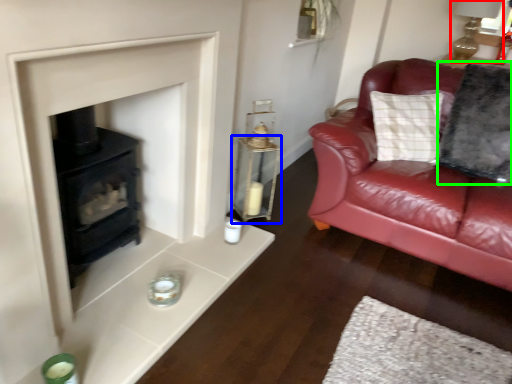
Question: Which object is positioned farthest from oil lamp (highlighted by a red box)? Select from table (highlighted by a blue box) and pillow (highlighted by a green box).

Choices:
 (A) table
 (B) pillow

Answer: (A)